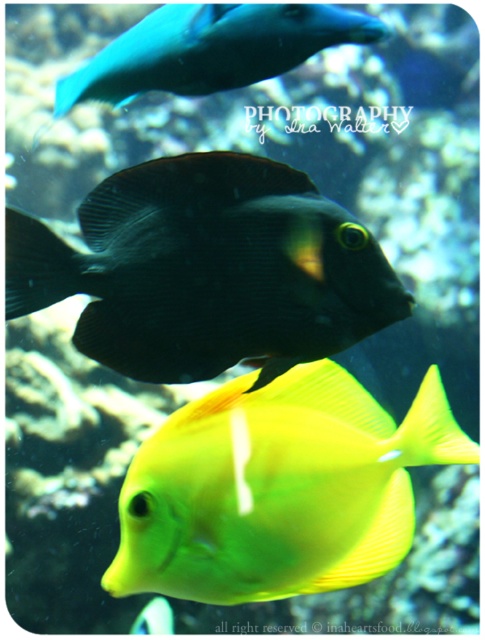
In the scene shown: You are an underwater photographer aiming to capture the matte black fish at center and the yellow matte fish at center in the same frame. Based on their positions, which fish should you adjust your camera to focus on first to ensure both are in the shot?

The matte black fish at center is to the left of the yellow matte fish at center, so you should focus on the matte black fish at center first to ensure both are in the frame.

You are a marine biologist observing an underwater scene. You need to locate the matte black fish at center. Can you tell me its coordinates?

The matte black fish at center is located at coordinates point (208, 269).